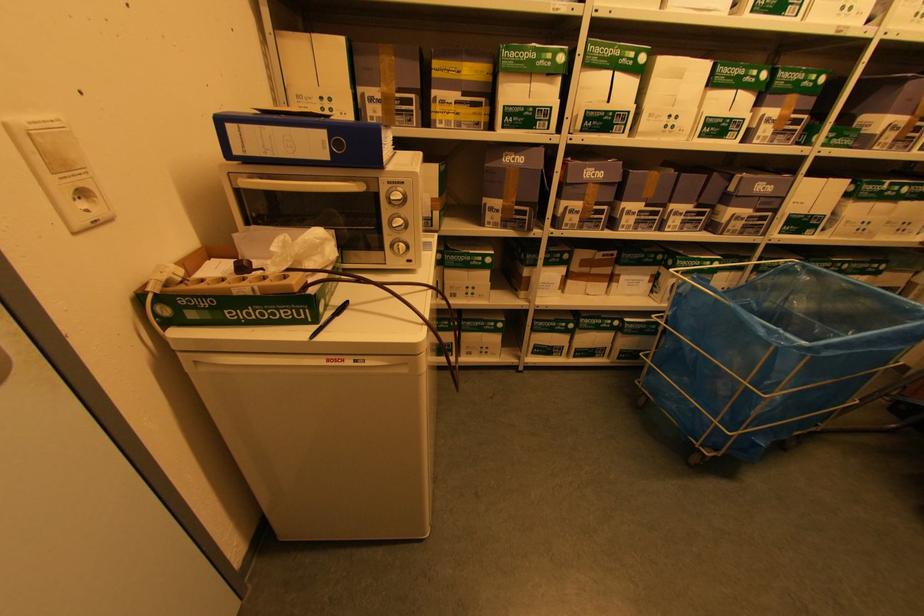
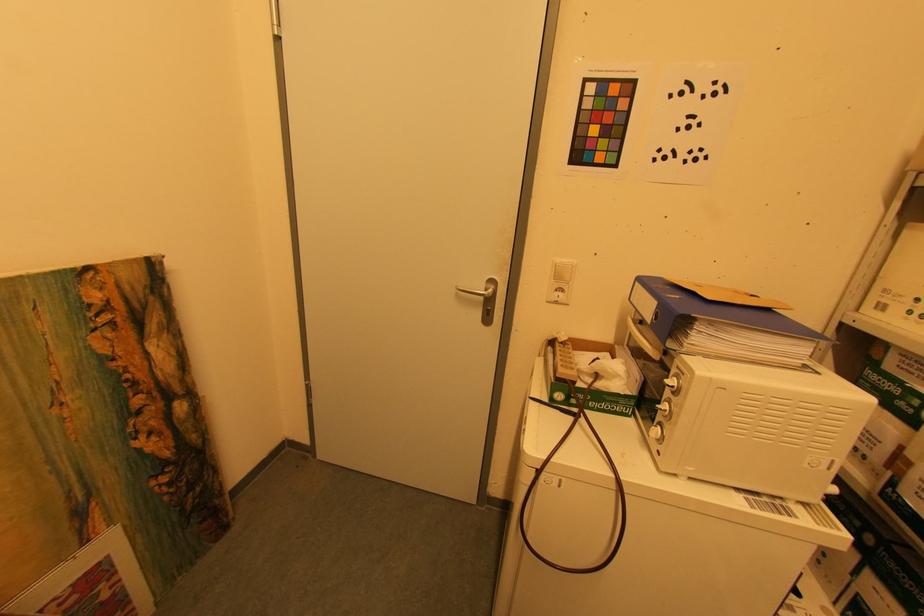
How did the camera likely rotate?

The camera's rotation is toward left-down.